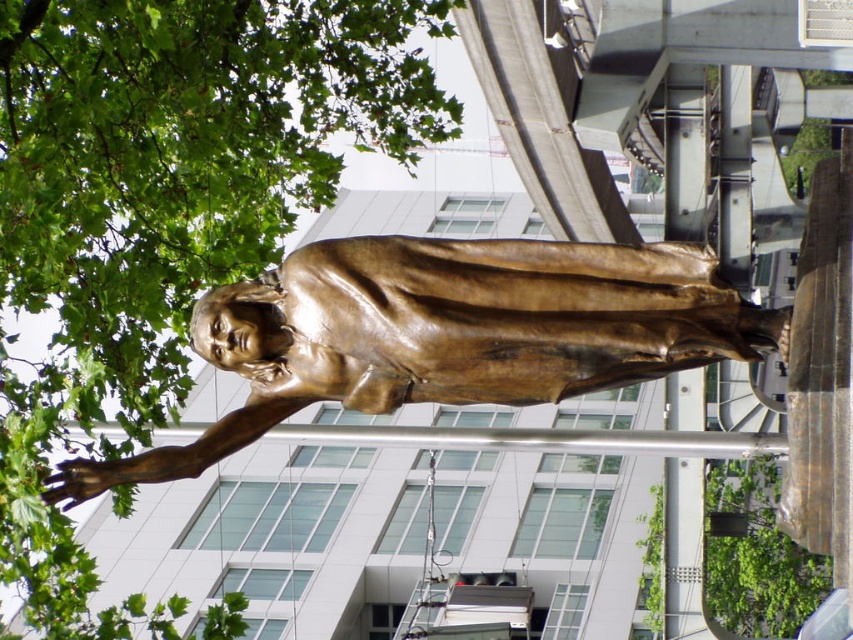
Is point (131, 362) positioned after point (746, 577)?

No, (131, 362) is closer to viewer.

Can you confirm if green leafy tree at upper left is taller than green leafy tree at upper center?

Indeed, green leafy tree at upper left has a greater height compared to green leafy tree at upper center.

Which is in front, point (143, 211) or point (747, 577)?

Positioned in front is point (143, 211).

This screenshot has height=640, width=853. In order to click on green leafy tree at upper left in this screenshot , I will do `click(161, 216)`.

Between point (436, 387) and point (650, 604), which one is positioned behind?

The point (650, 604) is behind.

Can you confirm if bronze statue at center is positioned to the left of green leafy tree at upper center?

Correct, you'll find bronze statue at center to the left of green leafy tree at upper center.

This screenshot has height=640, width=853. What do you see at coordinates (445, 333) in the screenshot?
I see `bronze statue at center` at bounding box center [445, 333].

At what (x,y) coordinates should I click in order to perform the action: click on bronze statue at center. Please return your answer as a coordinate pair (x, y). Image resolution: width=853 pixels, height=640 pixels. Looking at the image, I should click on (445, 333).

Is point (100, 625) less distant than point (285, 396)?

No, it is behind (285, 396).

Does green leafy tree at upper left have a greater height compared to bronze statue at center?

Indeed, green leafy tree at upper left has a greater height compared to bronze statue at center.

Is point (155, 40) in front of point (355, 262)?

No, it is behind (355, 262).

You are a GUI agent. You are given a task and a screenshot of the screen. Output one action in this format:
    pyautogui.click(x=<x>, y=<y>)
    Task: Click on the green leafy tree at upper left
    The width and height of the screenshot is (853, 640).
    Given the screenshot: What is the action you would take?
    pyautogui.click(x=161, y=216)